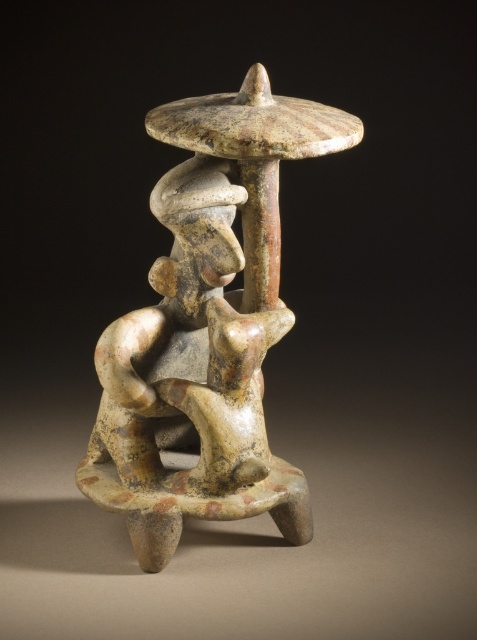
Can you confirm if speckled clay figure at center is positioned to the right of matte ceramic figure at center?

Indeed, speckled clay figure at center is positioned on the right side of matte ceramic figure at center.

Between point (255, 484) and point (214, 454), which one is positioned in front?

Point (214, 454) is in front.

Where is `speckled clay figure at center`? This screenshot has width=477, height=640. speckled clay figure at center is located at coordinates (207, 326).